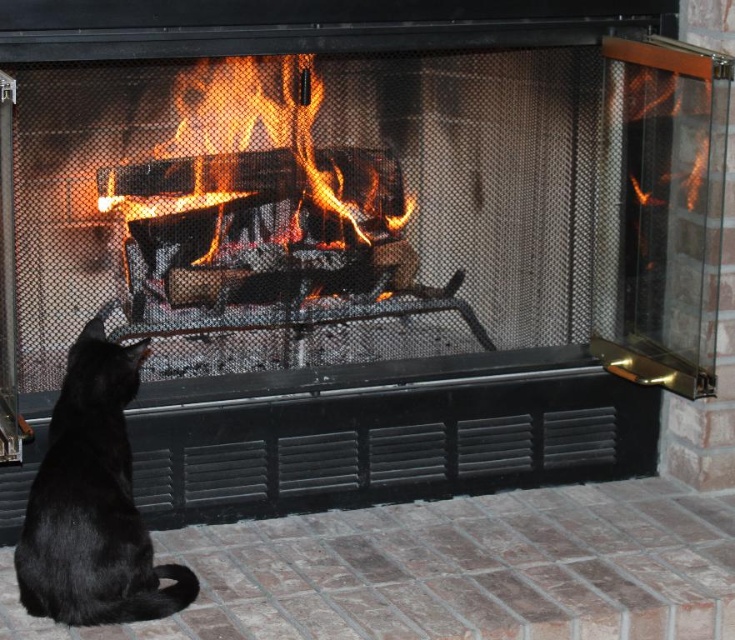
You are a pet owner who wants to ensure your black fur cat at lower left stays safe from the charcoal wood fire at center. Based on the scene, what is the minimum distance you should keep between them to prevent any accidents?

The black fur cat at lower left and charcoal wood fire at center are 33.47 inches apart from each other. To prevent accidents, the minimum safe distance should be maintained at least 33.47 inches or more between them.

From the picture: You are sitting on a couch and looking at the black fur cat at lower left and the charcoal wood fire at center. Which object is closer to you?

The black fur cat at lower left is closer to the viewer than the charcoal wood fire at center.

You are a photographer trying to capture the black fur cat at lower left and the charcoal wood fire at center in the same frame. Based on their sizes, which one would appear larger in the photo?

The black fur cat at lower left is much taller than the charcoal wood fire at center, so it would appear larger in the photo.